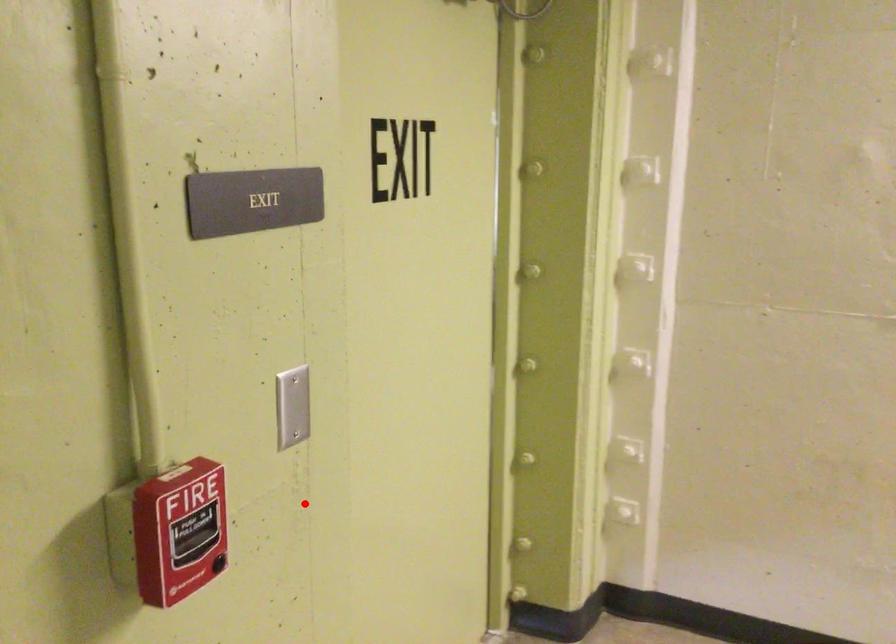
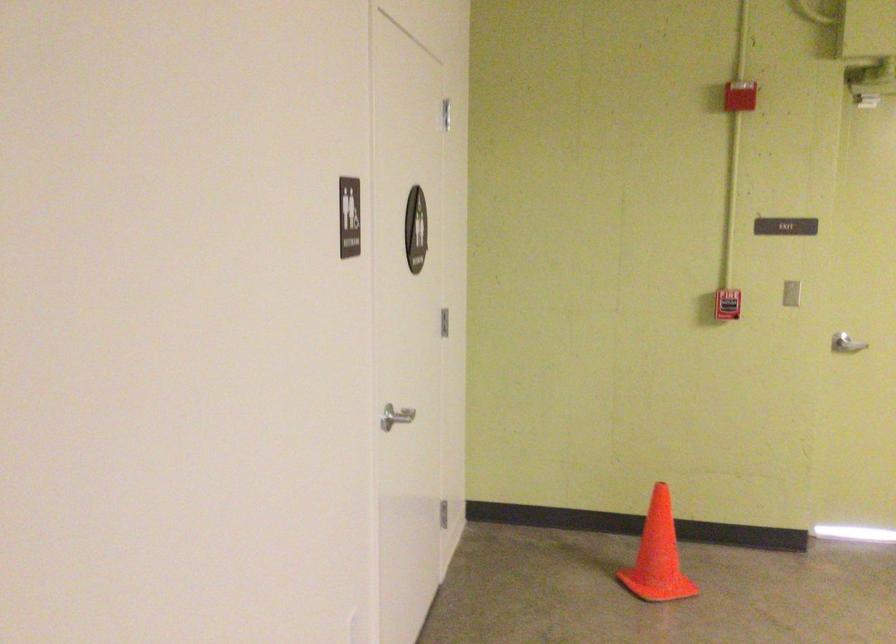
Find the pixel in the second image that matches the highlighted location in the first image.

(846, 344)